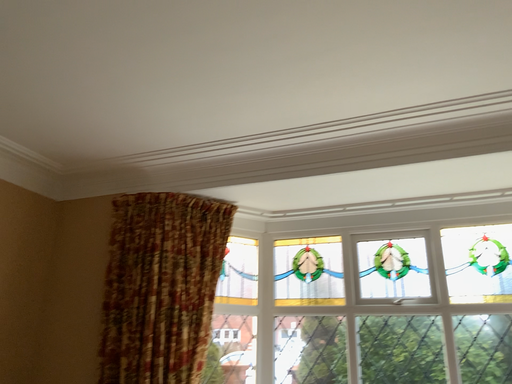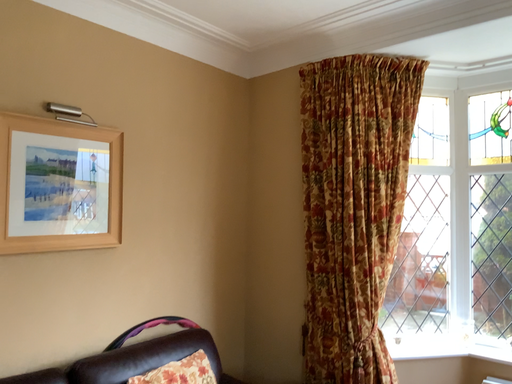
Question: Which way did the camera rotate in the video?

Choices:
 (A) rotated upward
 (B) rotated downward

Answer: (B)